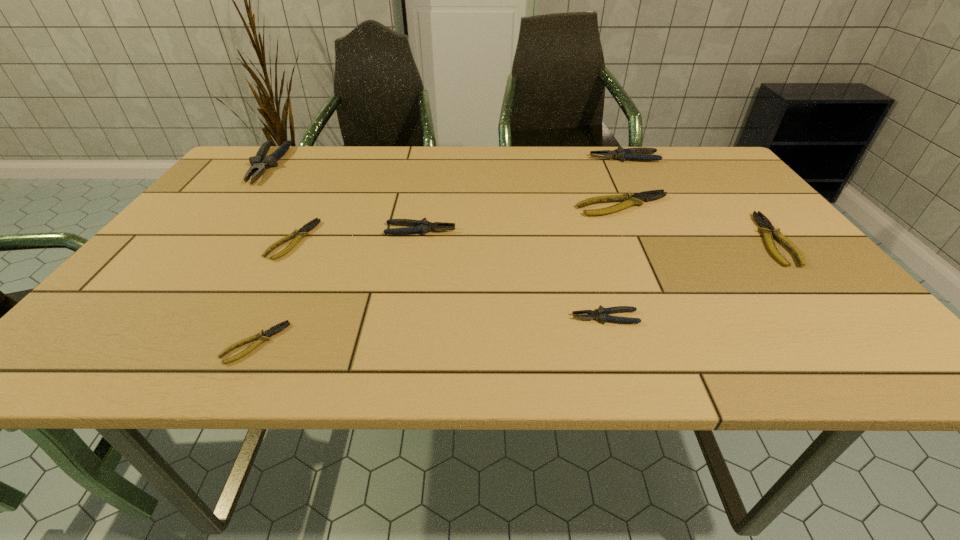
Image resolution: width=960 pixels, height=540 pixels. I want to click on free space between the biggest gray pliers and the second biggest yellow pliers, so click(519, 202).

I want to click on free space between the leftmost object and the third gray pliers from left to right, so click(x=436, y=241).

You are a GUI agent. You are given a task and a screenshot of the screen. Output one action in this format:
    pyautogui.click(x=<x>, y=<y>)
    Task: Click on the free space between the nearest yellow pliers and the seventh shortest object
    
    Given the screenshot: What is the action you would take?
    pyautogui.click(x=440, y=251)

At what (x,y) coordinates should I click in order to perform the action: click on free spot between the third gray pliers from left to right and the seventh tallest pliers. Please return your answer as a coordinate pair (x, y). The width and height of the screenshot is (960, 540). Looking at the image, I should click on (449, 279).

Where is `empty location between the shortest object and the fourth pliers from left to right`? The image size is (960, 540). empty location between the shortest object and the fourth pliers from left to right is located at coordinates (338, 287).

Locate an element on the screen. empty space between the leftmost object and the shortest pliers is located at coordinates (261, 254).

You are a GUI agent. You are given a task and a screenshot of the screen. Output one action in this format:
    pyautogui.click(x=<x>, y=<y>)
    Task: Click on the object identified as the seventh closest to the second yellow pliers from right to left
    The height and width of the screenshot is (540, 960).
    Given the screenshot: What is the action you would take?
    pyautogui.click(x=259, y=163)

Choose which object is the seventh nearest neighbor to the biggest yellow pliers. Please provide its 2D coordinates. Your answer should be formatted as a tuple, i.e. [(x, y)], where the tuple contains the x and y coordinates of a point satisfying the conditions above.

[(259, 163)]

This screenshot has height=540, width=960. Find the location of `pliers that is the sixth closest to the third biggest yellow pliers`. pliers that is the sixth closest to the third biggest yellow pliers is located at coordinates (640, 153).

Identify the location of the sixth closest pliers to the smallest gray pliers. This screenshot has height=540, width=960. (640, 153).